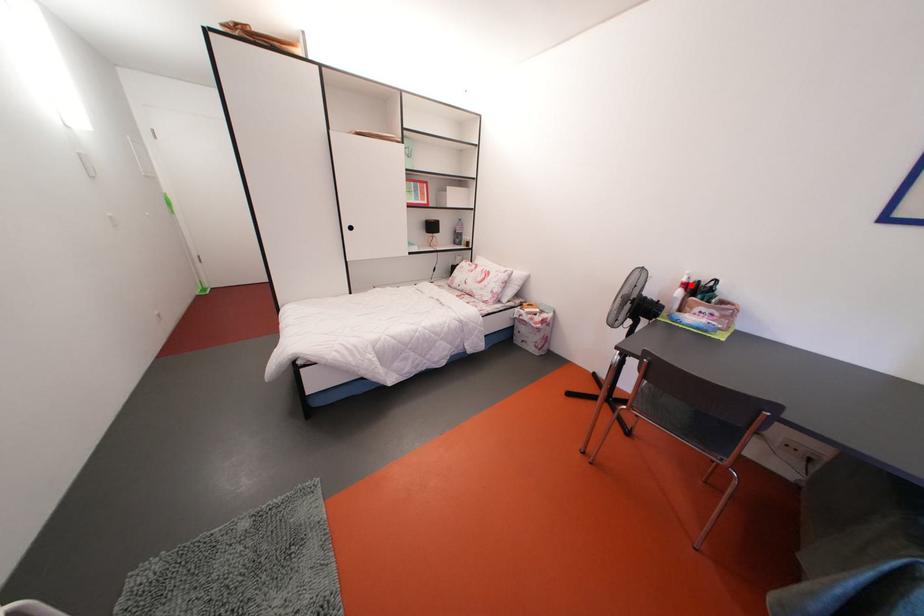
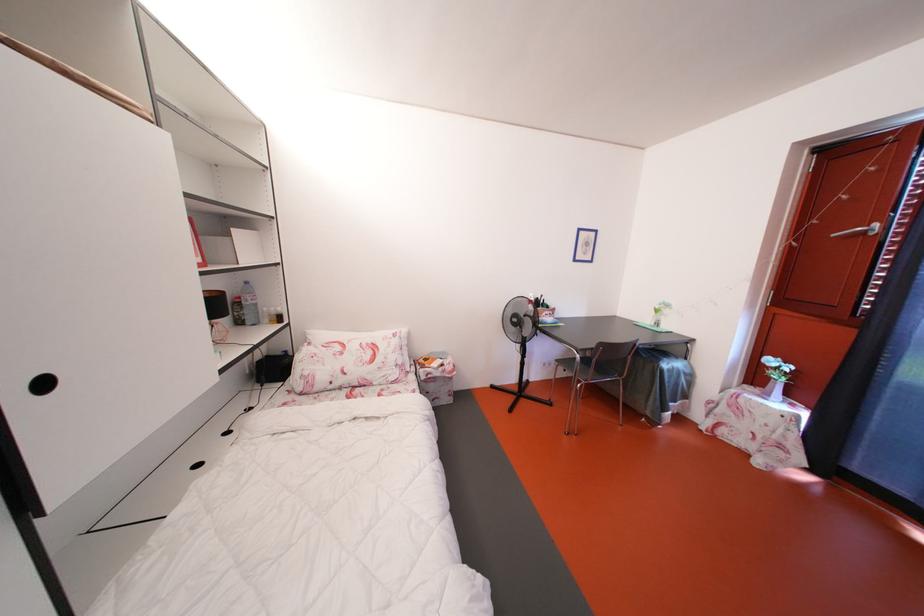
In the second image, find the point that corresponds to the highlighted location in the first image.

(540, 305)